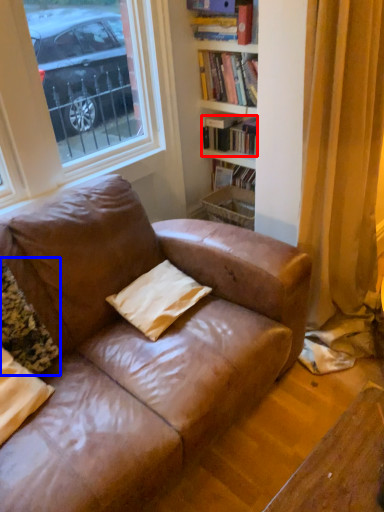
Question: Among these objects, which one is nearest to the camera, book (highlighted by a red box) or pillow (highlighted by a blue box)?

Choices:
 (A) book
 (B) pillow

Answer: (B)